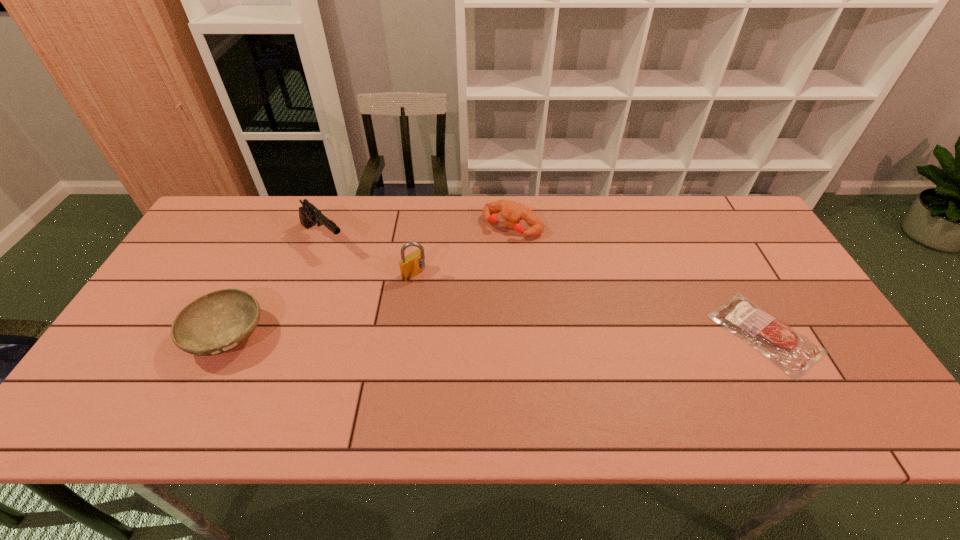
You are a GUI agent. You are given a task and a screenshot of the screen. Output one action in this format:
    pyautogui.click(x=<x>, y=<y>)
    Task: Click on the bowl located at the near edge
    The width and height of the screenshot is (960, 540).
    Given the screenshot: What is the action you would take?
    pyautogui.click(x=215, y=323)

Identify the location of steak situated at the near edge. (795, 354).

You are a GUI agent. You are given a task and a screenshot of the screen. Output one action in this format:
    pyautogui.click(x=<x>, y=<y>)
    Task: Click on the object that is at the left edge
    The width and height of the screenshot is (960, 540).
    Given the screenshot: What is the action you would take?
    pyautogui.click(x=215, y=323)

Where is `object that is at the right edge`? This screenshot has height=540, width=960. object that is at the right edge is located at coordinates (795, 354).

Locate an element on the screen. The height and width of the screenshot is (540, 960). object located in the near left corner section of the desktop is located at coordinates (215, 323).

This screenshot has height=540, width=960. I want to click on object that is at the near right corner, so click(795, 354).

Where is `vacant space at the far edge`? The height and width of the screenshot is (540, 960). vacant space at the far edge is located at coordinates (293, 230).

Identify the location of blank space at the near edge of the desktop. (219, 374).

This screenshot has height=540, width=960. In order to click on vacant region at the left edge in this screenshot , I will do `click(203, 267)`.

The height and width of the screenshot is (540, 960). Find the location of `free region at the right edge of the desktop`. free region at the right edge of the desktop is located at coordinates (756, 296).